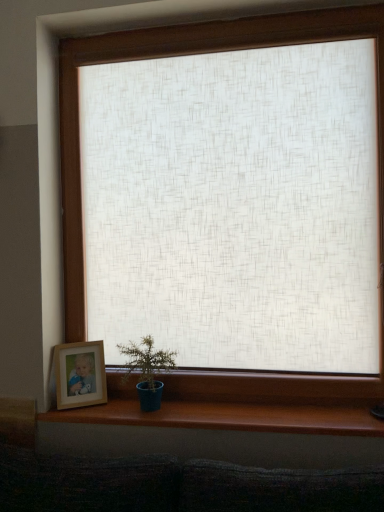
Question: Is brown wood at lower center taller or shorter than wooden picture frame at lower left?

Choices:
 (A) tall
 (B) short

Answer: (B)

Question: From the image's perspective, is brown wood at lower center positioned above or below wooden picture frame at lower left?

Choices:
 (A) below
 (B) above

Answer: (A)

Question: Based on their relative distances, which object is nearer to the wooden picture frame at lower left?

Choices:
 (A) brown wood at lower center
 (B) blue matte pot at lower left

Answer: (B)

Question: Which object is the closest to the blue matte pot at lower left?

Choices:
 (A) wooden picture frame at lower left
 (B) brown wood at lower center

Answer: (A)